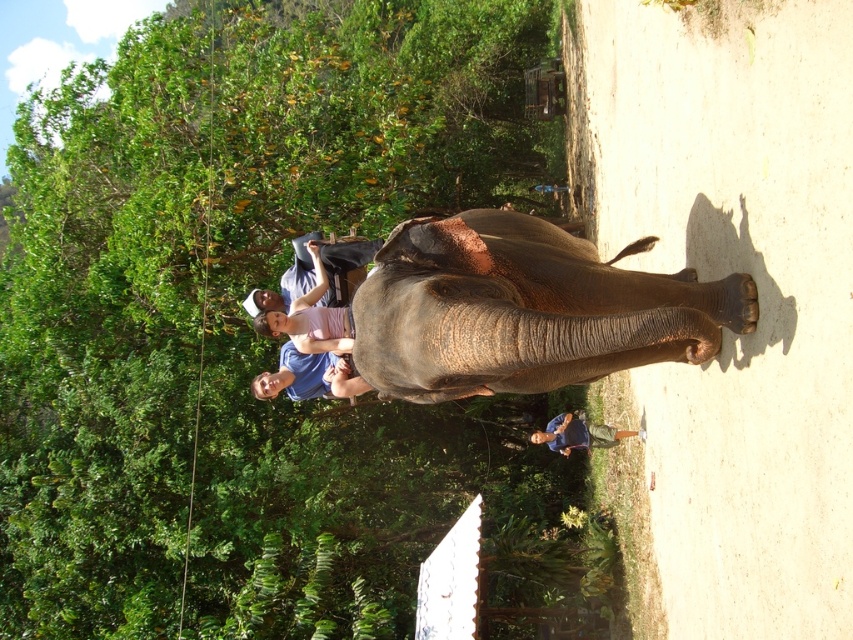
Question: Where is green leafy tree at upper left located in relation to matte blue shirt at center in the image?

Choices:
 (A) left
 (B) right

Answer: (A)

Question: Can you confirm if matte blue shirt at center is smaller than blue fabric shirt at center?

Choices:
 (A) yes
 (B) no

Answer: (B)

Question: Which point is closer to the camera taking this photo?

Choices:
 (A) (442, 504)
 (B) (637, 433)
 (C) (303, 360)
 (D) (541, 244)

Answer: (D)

Question: Among these points, which one is farthest from the camera?

Choices:
 (A) (321, 340)
 (B) (363, 304)
 (C) (286, 198)
 (D) (618, 436)

Answer: (C)

Question: Which object is farther from the camera taking this photo?

Choices:
 (A) gray textured elephant at center
 (B) blue fabric shirt at center
 (C) matte blue shirt at center
 (D) green leafy tree at upper left

Answer: (B)

Question: Can you confirm if gray textured elephant at center is bigger than blue fabric shirt at center?

Choices:
 (A) yes
 (B) no

Answer: (A)